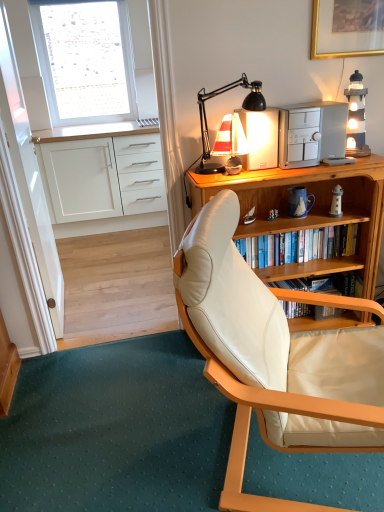
Identify the location of vacant space to the right of transparent glass door at left. (119, 308).